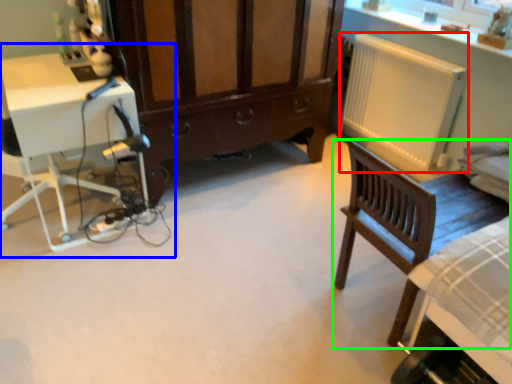
Question: Which object is the closest to the radiator (highlighted by a red box)? Choose among these: computer desk (highlighted by a blue box) or chair (highlighted by a green box).

Choices:
 (A) computer desk
 (B) chair

Answer: (B)